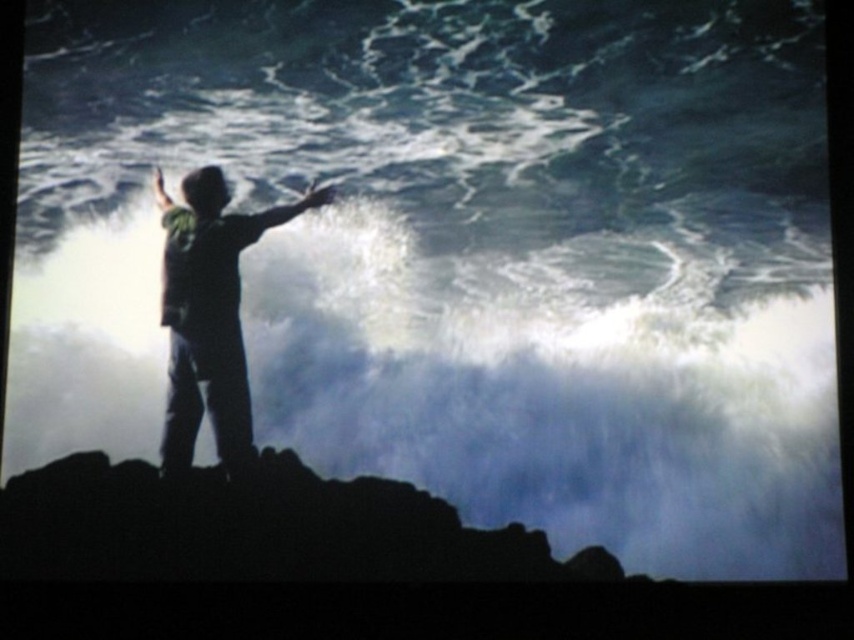
You are a photographer analyzing the composition of this dramatic scene. You notice the silvery metallic arm at center and the matte green shirt at center. Which object is placed lower in the image?

The silvery metallic arm at center is positioned under the matte green shirt at center, so it is placed lower in the image.

You are a photographer trying to capture the silhouette clothing at center and the matte green shirt at center in the same frame. Which object should you focus on first to ensure both are in focus?

The silhouette clothing at center is larger in size than the matte green shirt at center, so focusing on the larger silhouette clothing at center first will help ensure both are in focus.